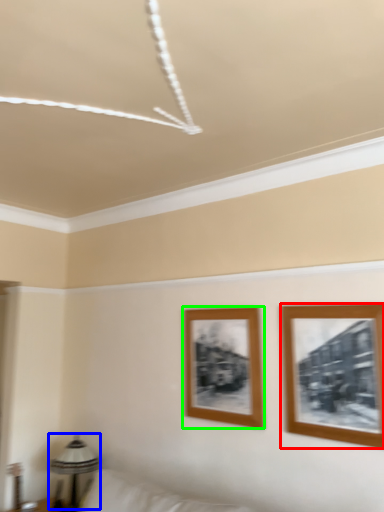
Question: Which object is the farthest from picture frame (highlighted by a red box)? Choose among these: table lamp (highlighted by a blue box) or picture frame (highlighted by a green box).

Choices:
 (A) table lamp
 (B) picture frame

Answer: (A)